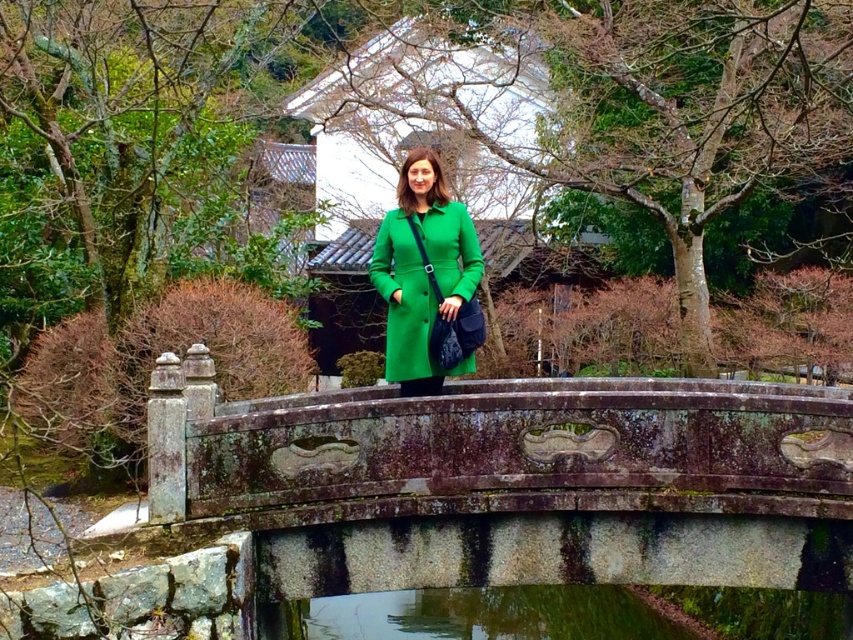
Question: Is rusty stone bridge at center thinner than green matte coat at center?

Choices:
 (A) yes
 (B) no

Answer: (B)

Question: Which of these objects is positioned farthest from the green matte coat at center?

Choices:
 (A) rusty stone bridge at center
 (B) clear water at bridge center

Answer: (B)

Question: Which object appears closest to the camera in this image?

Choices:
 (A) rusty stone bridge at center
 (B) clear water at bridge center

Answer: (A)

Question: From the image, what is the correct spatial relationship of rusty stone bridge at center in relation to clear water at bridge center?

Choices:
 (A) right
 (B) left

Answer: (B)

Question: Is clear water at bridge center closer to camera compared to green matte coat at center?

Choices:
 (A) yes
 (B) no

Answer: (B)

Question: Which object appears closest to the camera in this image?

Choices:
 (A) rusty stone bridge at center
 (B) clear water at bridge center
 (C) green matte coat at center

Answer: (A)